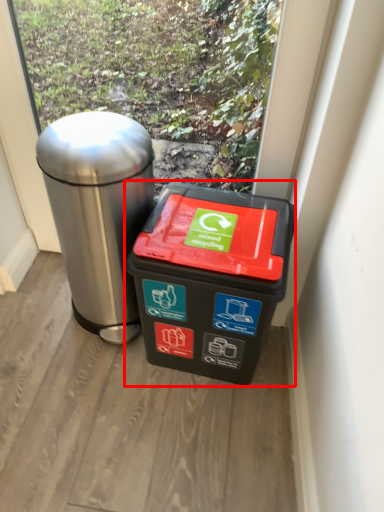
Question: From the image's perspective, where is waste container (annotated by the red box) located relative to waste container?

Choices:
 (A) above
 (B) below

Answer: (B)